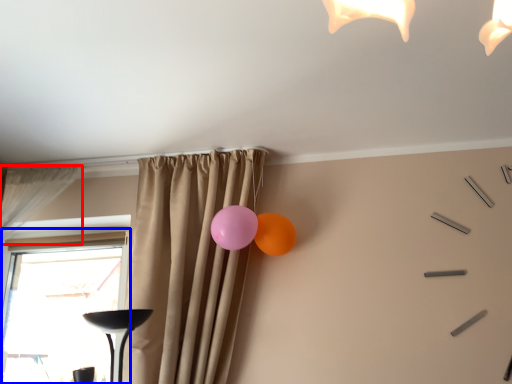
Question: Which object is closer to the camera taking this photo, curtain (highlighted by a red box) or window (highlighted by a blue box)?

Choices:
 (A) curtain
 (B) window

Answer: (A)